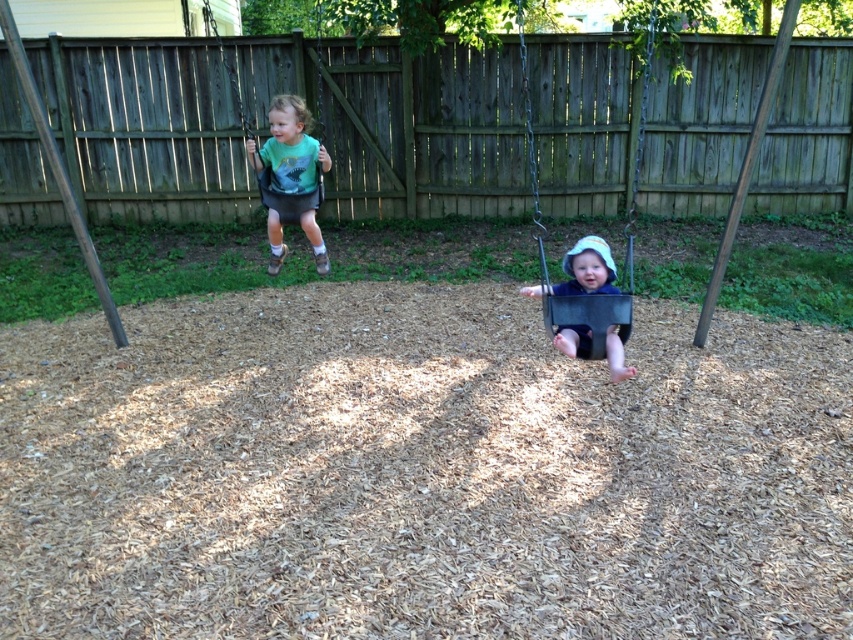
Question: Which is nearer to the brown wood pole at left?

Choices:
 (A) metallic gray swing at center
 (B) matte green fabric swing at upper left
 (C) brown wood pole at upper right
 (D) green t-shirt at upper left

Answer: (D)

Question: Which point appears closest to the camera in this image?

Choices:
 (A) (589, 246)
 (B) (589, 300)
 (C) (740, 216)
 (D) (4, 22)

Answer: (A)

Question: Can you confirm if green t-shirt at upper left is wider than brown wood pole at upper right?

Choices:
 (A) no
 (B) yes

Answer: (B)

Question: Observing the image, what is the correct spatial positioning of matte black swing at center in reference to matte green fabric swing at upper left?

Choices:
 (A) right
 (B) left

Answer: (A)

Question: Which point is farther from the camera taking this photo?

Choices:
 (A) (103, 292)
 (B) (723, 273)

Answer: (B)

Question: Does matte black swing at center have a greater width compared to brown wood pole at left?

Choices:
 (A) yes
 (B) no

Answer: (B)